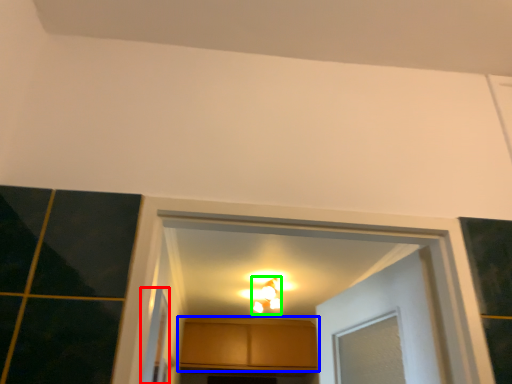
Question: Which object is the closest to the screen door (highlighted by a red box)? Choose among these: cabinetry (highlighted by a blue box) or light fixture (highlighted by a green box).

Choices:
 (A) cabinetry
 (B) light fixture

Answer: (B)